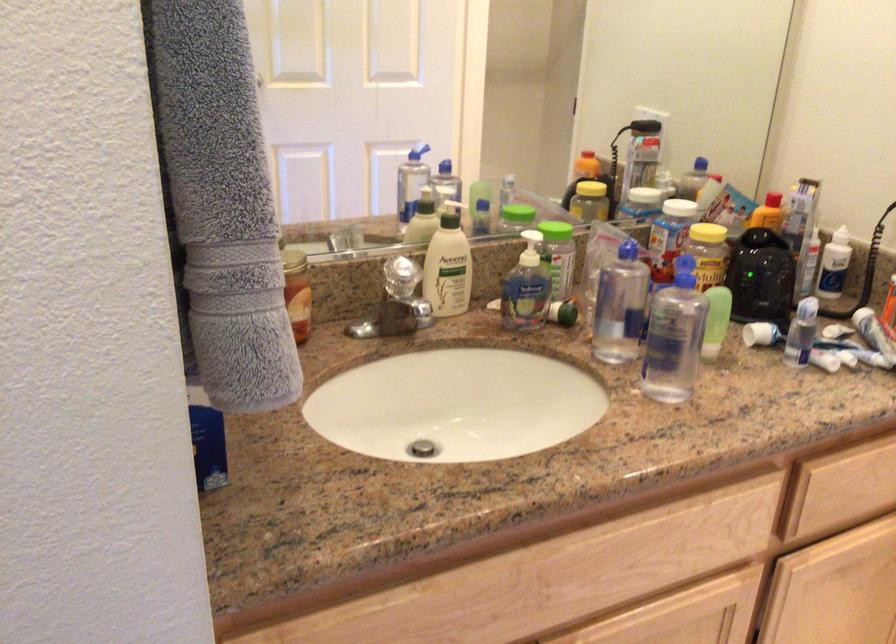
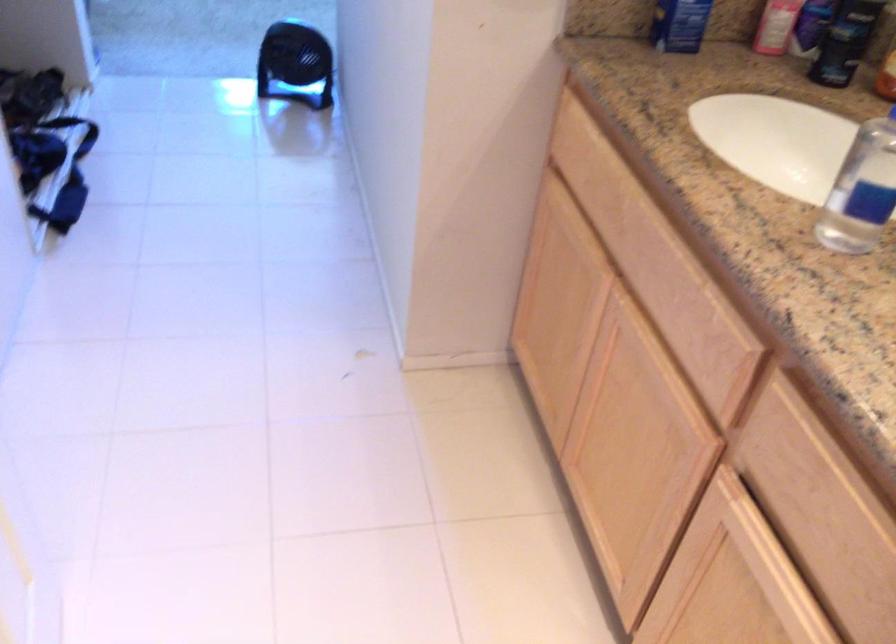
Locate, in the second image, the point that corresponds to (225,426) in the first image.

(679, 24)